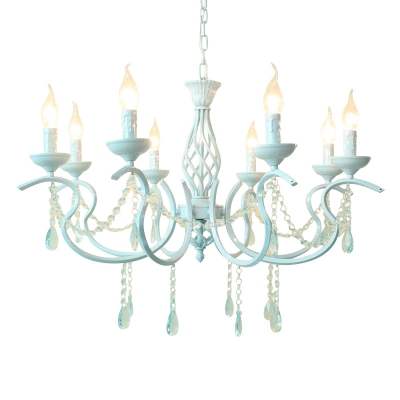
Find the location of a particular element. The image size is (400, 400). chandelier is located at coordinates (198, 172).